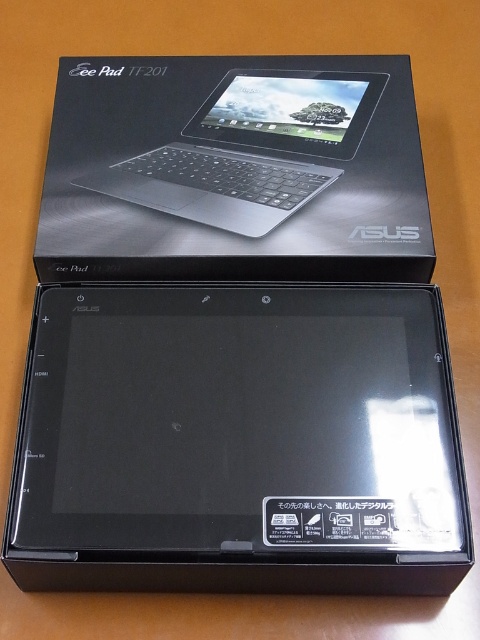
You are examining the open box with the ASUS Eee Pad TF201 tablet inside. There are two points marked on the box at coordinates point [133,529] and point [298,208]. If you were to touch both points simultaneously with your fingers, which point would feel closer to your fingertips?

Point [133,529] is in front of point [298,208], so touching both points simultaneously, the point [133,529] would feel closer to your fingertips.

You are setting up a display for an electronics store. You have a black glossy tablet at center and a satin black laptop at upper center. The store manager wants to arrange them so that the taller item is placed on the higher shelf. Which device should go on the higher shelf?

The black glossy tablet at center should be placed on the higher shelf because it has a greater height compared to the satin black laptop at upper center.